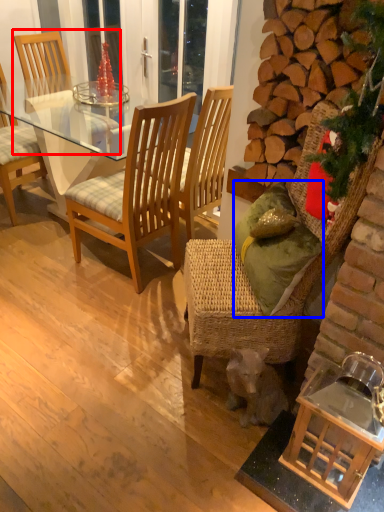
Question: Among these objects, which one is nearest to the camera, chair (highlighted by a red box) or pillow (highlighted by a blue box)?

Choices:
 (A) chair
 (B) pillow

Answer: (B)